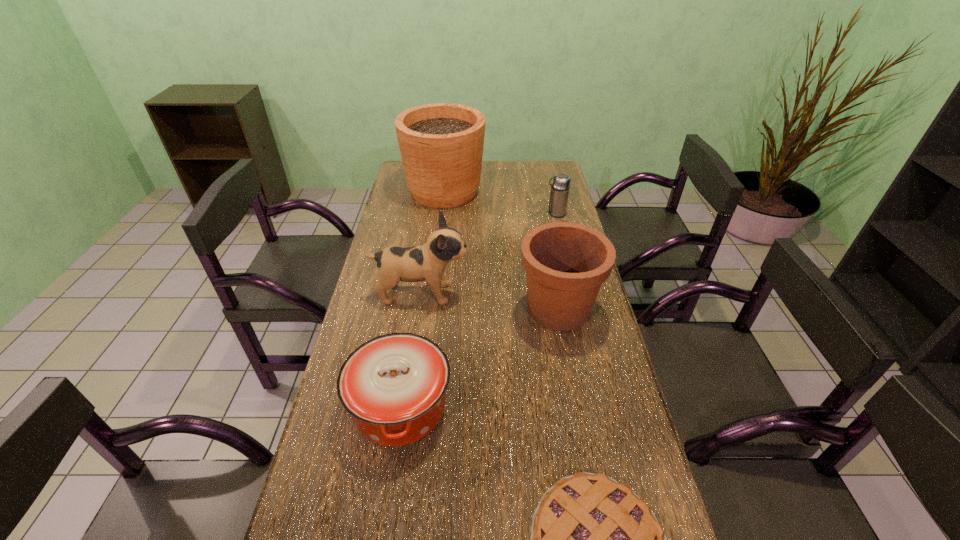
This screenshot has height=540, width=960. Find the location of `the farther flowerpot`. the farther flowerpot is located at coordinates (441, 144).

Find the location of a particular element. This screenshot has height=540, width=960. the taller flowerpot is located at coordinates (441, 144).

Identify the location of puppy. [427, 263].

This screenshot has width=960, height=540. In order to click on the right flowerpot in this screenshot , I will do `click(566, 263)`.

Where is `the third tallest object`? The height and width of the screenshot is (540, 960). the third tallest object is located at coordinates (566, 263).

Find the location of a particular element. thermos bottle is located at coordinates (561, 184).

Image resolution: width=960 pixels, height=540 pixels. Find the location of `casserole`. casserole is located at coordinates (394, 385).

I want to click on free space located 0.080m on the right of the farther flowerpot, so click(x=504, y=191).

Where is `free space located 0.140m at the face of the puppy`? free space located 0.140m at the face of the puppy is located at coordinates (513, 294).

Where is `free point located 0.070m on the back of the shorter flowerpot`? The height and width of the screenshot is (540, 960). free point located 0.070m on the back of the shorter flowerpot is located at coordinates (551, 267).